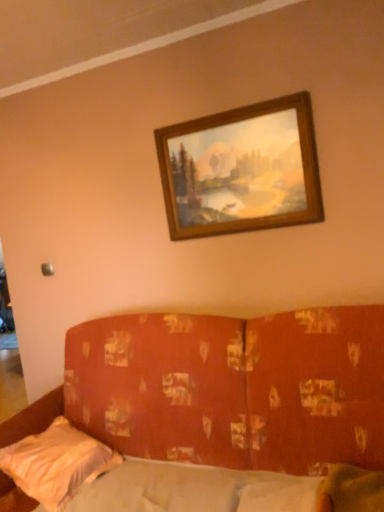
Question: Does point (117, 462) appear closer or farther from the camera than point (329, 484)?

Choices:
 (A) farther
 (B) closer

Answer: (A)

Question: Is white satin pillow at lower left situated inside white fabric mattress at lower center or outside?

Choices:
 (A) inside
 (B) outside

Answer: (B)

Question: Estimate the real-world distances between objects in this image. Which object is farther from the white fabric mattress at lower center?

Choices:
 (A) textured orange fabric couch at center
 (B) wooden frame at upper center
 (C) white satin pillow at lower left

Answer: (B)

Question: Which object is the closest to the textured orange fabric couch at center?

Choices:
 (A) white fabric mattress at lower center
 (B) wooden frame at upper center
 (C) white satin pillow at lower left

Answer: (A)